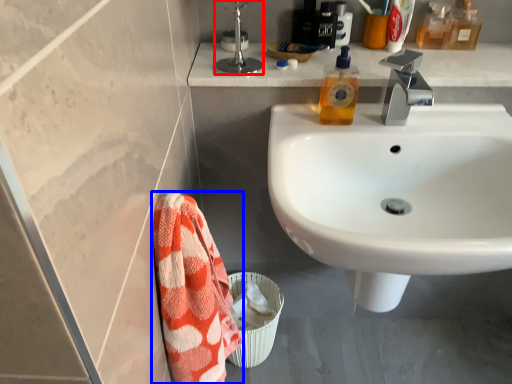
Question: Among these objects, which one is farthest to the camera, plumbing fixture (highlighted by a red box) or beach towel (highlighted by a blue box)?

Choices:
 (A) plumbing fixture
 (B) beach towel

Answer: (A)